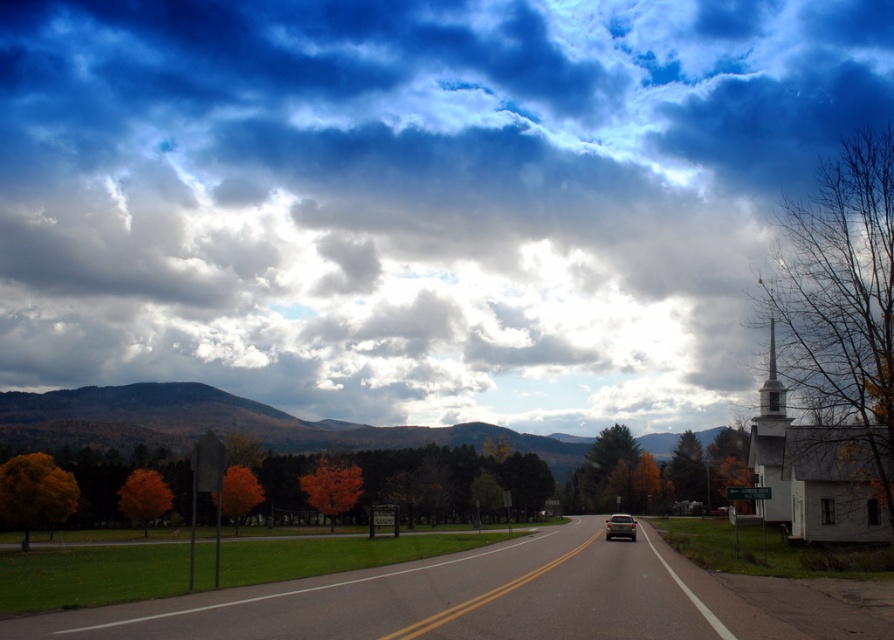
Question: Which of these objects is positioned closest to the green textured pine tree at right?

Choices:
 (A) green forested mountain at center
 (B) orange matte tree at left

Answer: (A)

Question: Can you confirm if cloudy sky at upper center is wider than green forested mountain at center?

Choices:
 (A) no
 (B) yes

Answer: (B)

Question: Estimate the real-world distances between objects in this image. Which object is farther from the green textured pine tree at right?

Choices:
 (A) bare wood steeple at right
 (B) orange matte tree at center
 (C) cloudy sky at upper center
 (D) golden-brown foliage at left

Answer: (C)

Question: Is orange matte tree at left closer to camera compared to satin silver sedan at center?

Choices:
 (A) no
 (B) yes

Answer: (B)

Question: Can you confirm if green textured pine tree at right is positioned above satin silver sedan at center?

Choices:
 (A) no
 (B) yes

Answer: (B)

Question: Which is farther from the orange matte tree at center?

Choices:
 (A) orange matte tree at left
 (B) green textured pine tree at right

Answer: (B)